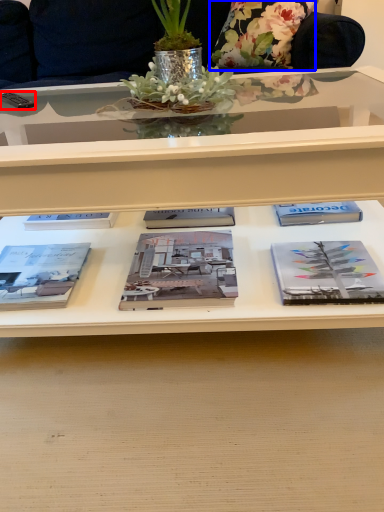
Question: Which object is closer to the camera taking this photo, remote control (highlighted by a red box) or flower (highlighted by a blue box)?

Choices:
 (A) remote control
 (B) flower

Answer: (A)